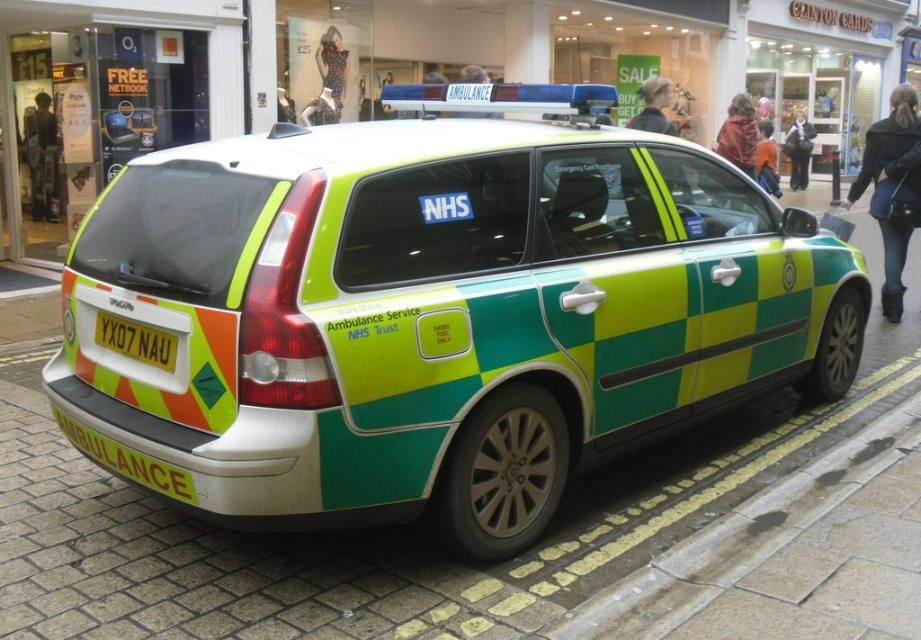
Question: Is green checkered ambulance at center positioned before yellow metallic license plate at rear?

Choices:
 (A) no
 (B) yes

Answer: (B)

Question: Can you confirm if green checkered ambulance at center is wider than yellow metallic license plate at rear?

Choices:
 (A) no
 (B) yes

Answer: (B)

Question: Is green checkered ambulance at center positioned before yellow metallic license plate at rear?

Choices:
 (A) yes
 (B) no

Answer: (A)

Question: Which point is closer to the camera?

Choices:
 (A) green checkered ambulance at center
 (B) yellow metallic license plate at rear

Answer: (A)

Question: Which object appears farthest from the camera in this image?

Choices:
 (A) green checkered ambulance at center
 (B) yellow metallic license plate at rear

Answer: (B)